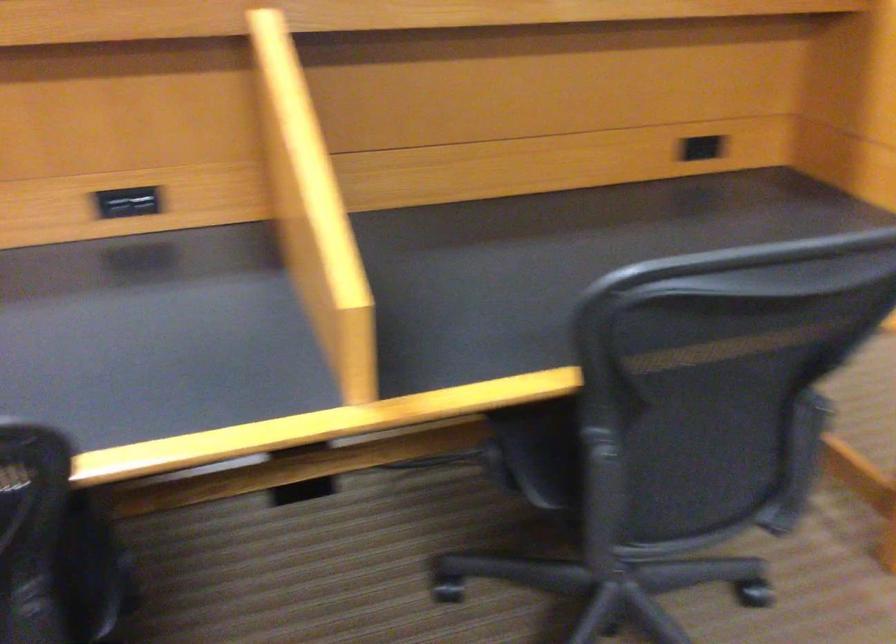
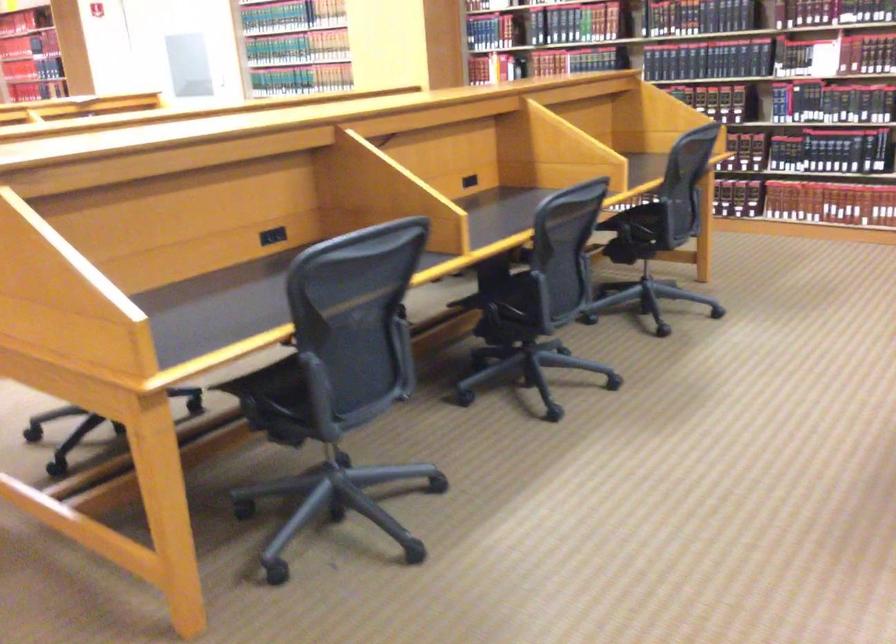
In the second image, find the point that corresponds to (x=228, y=225) in the first image.

(469, 181)